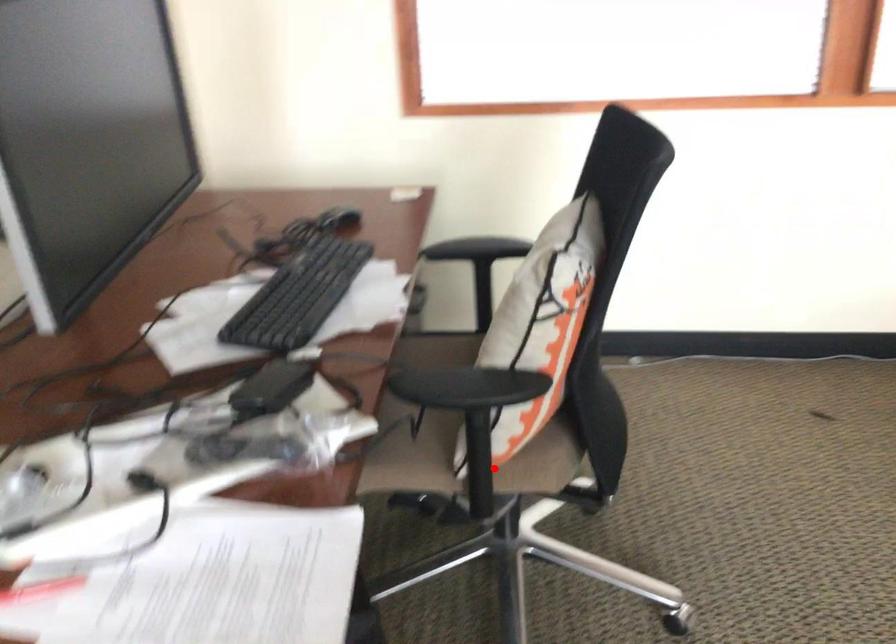
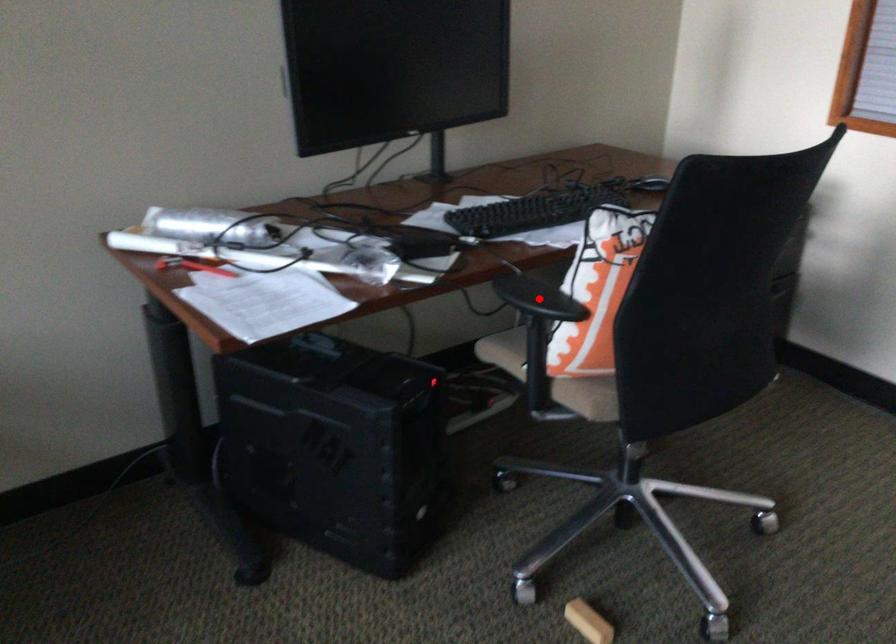
I am providing you with two images of the same scene from different viewpoints. A red point is marked on the first image and another point is marked on the second image. Does the point marked in image1 correspond to the same location as the one in image2?

No